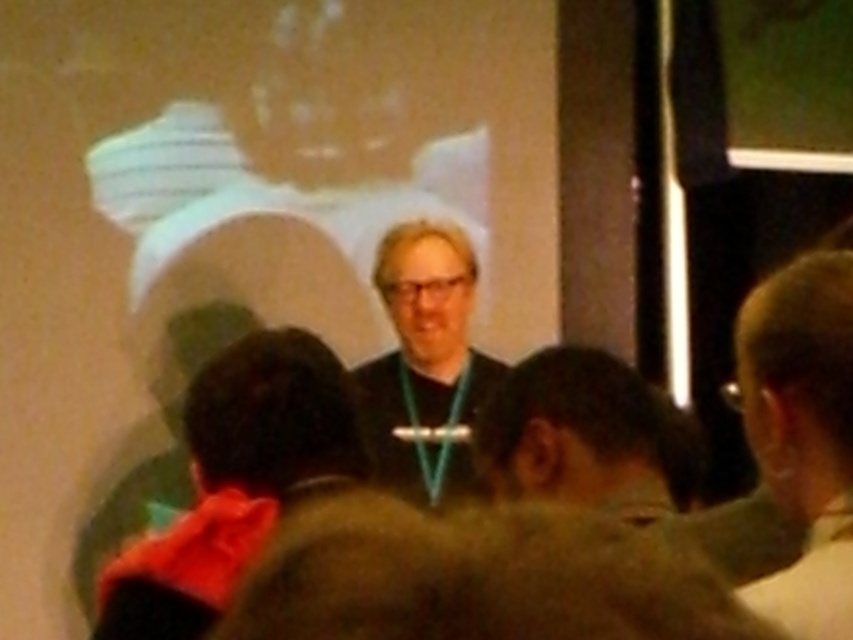
Is dark brown hair at center behind matte black shirt at center?

No, it is in front of matte black shirt at center.

Who is shorter, dark brown hair at center or matte black shirt at center?

Standing shorter between the two is dark brown hair at center.

Where is `dark brown hair at center`? dark brown hair at center is located at coordinates (582, 435).